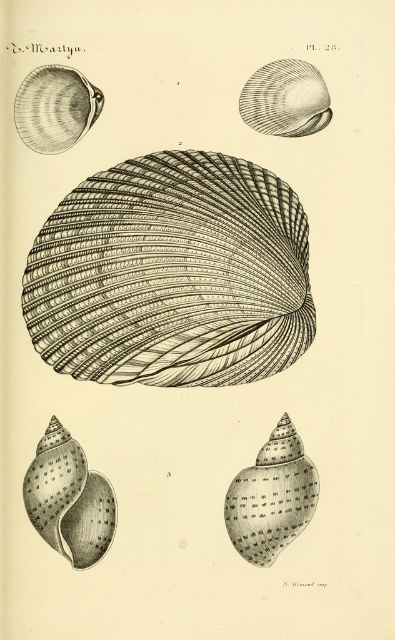
Question: Which point is closer to the camera taking this photo?

Choices:
 (A) (114, 381)
 (B) (22, 136)
 (C) (223, 516)

Answer: (A)

Question: Which object appears farthest from the camera in this image?

Choices:
 (A) smooth brown shell at center
 (B) smooth gray shell at lower left

Answer: (A)

Question: Observing the image, what is the correct spatial positioning of smooth brown shell at center in reference to smooth brown shell at upper left?

Choices:
 (A) below
 (B) above

Answer: (A)

Question: Is black line drawing shell at center below smooth brown shell at upper left?

Choices:
 (A) yes
 (B) no

Answer: (A)

Question: Is black line drawing shell at center to the right of smooth gray shell at upper right from the viewer's perspective?

Choices:
 (A) yes
 (B) no

Answer: (B)

Question: Among these points, which one is nearest to the camera?

Choices:
 (A) (x=84, y=468)
 (B) (x=293, y=83)

Answer: (A)